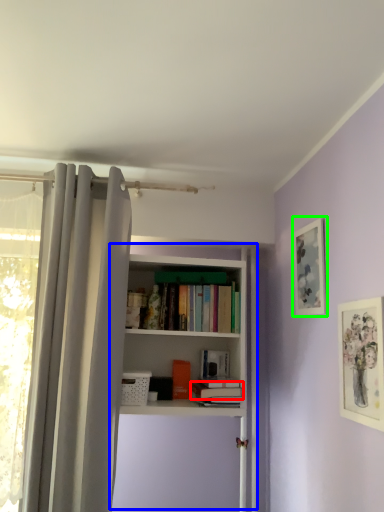
Question: Based on their relative distances, which object is nearer to book (highlighted by a red box)? Choose from shelf (highlighted by a blue box) and picture frame (highlighted by a green box).

Choices:
 (A) shelf
 (B) picture frame

Answer: (A)